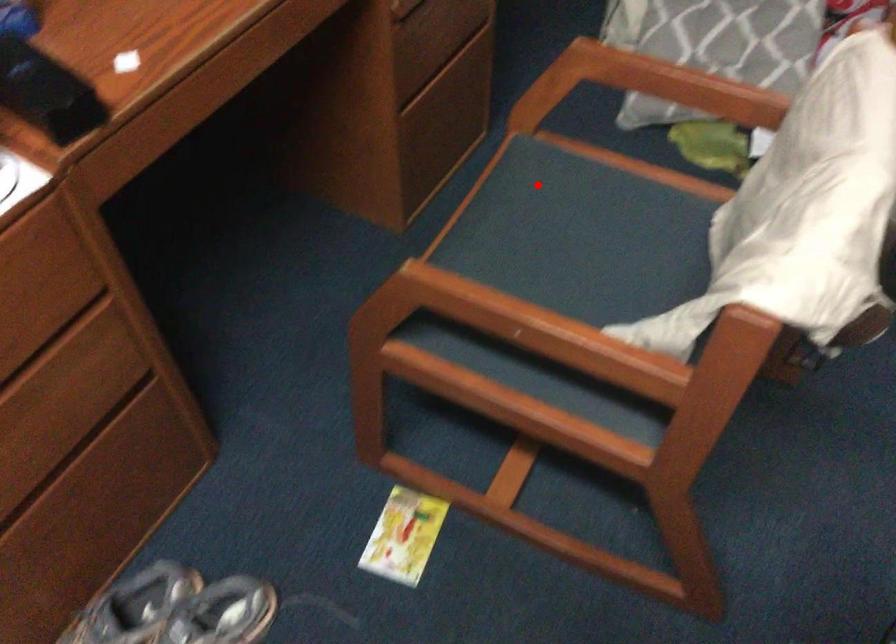
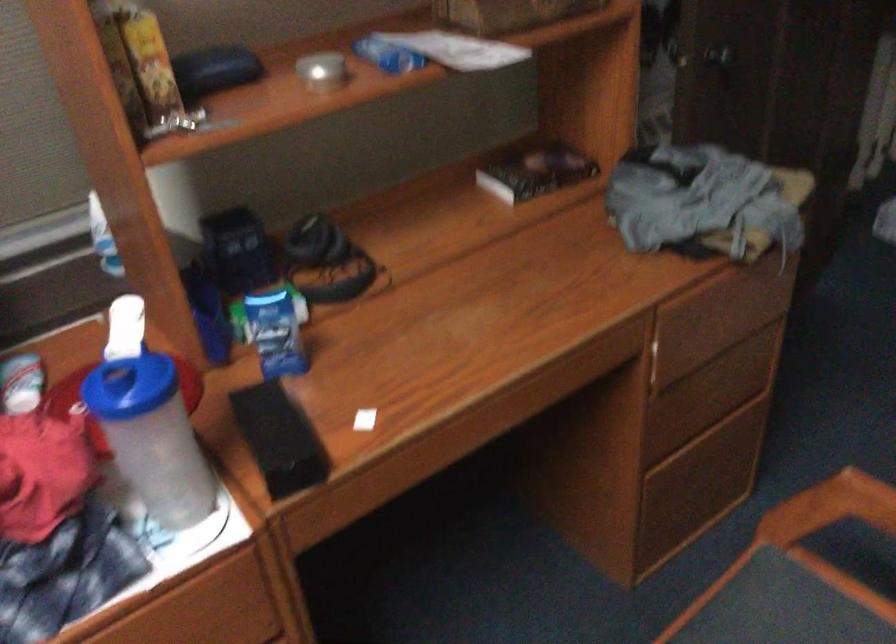
Where in the second image is the point corresponding to the highlighted location from the first image?

(780, 614)